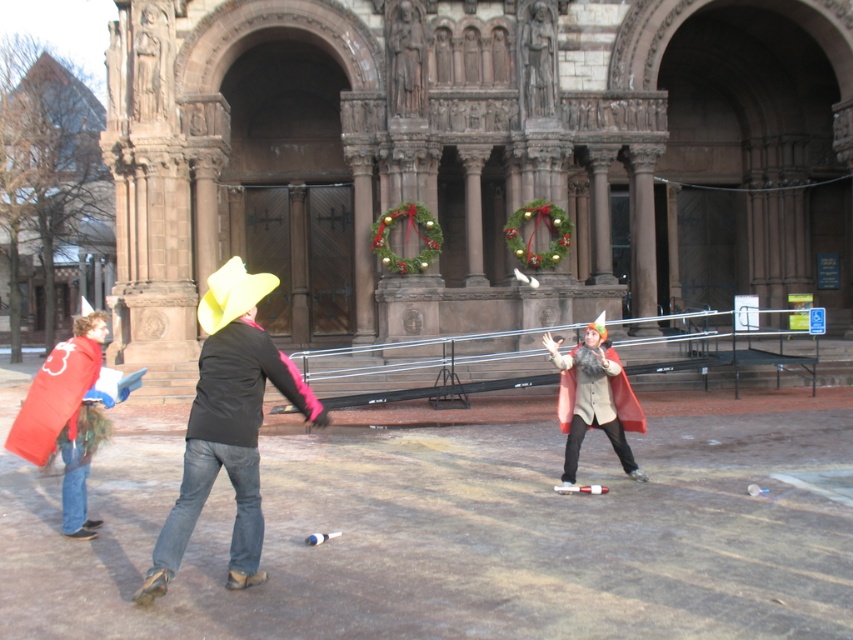
You are a photographer standing in front of the historic building. You want to take a photo of the denim jeans at center and the velvet red cape at center so that both are clearly visible. Which object should you focus on first to ensure proper focus, considering their heights?

The denim jeans at center is much taller than the velvet red cape at center. Therefore, you should focus on the denim jeans at center first since it is taller and might be further away, ensuring the depth of field captures both subjects effectively.

You are standing at the origin point of the image. A friend is wearing denim jeans at center. If you want to walk directly towards their location, which direction should you head? Please provide coordinates based on the image coordinate system where the bottom left corner is the origin point.

The denim jeans at center is located at coordinates point (228, 424). To walk directly towards them, you should head towards the coordinates point (228, 424).

You are a photographer standing in front of the historic building and want to capture a photo of the two people in denim jeans at center and velvet red cape at center. Which one should you focus on first if you want to capture them from left to right in the order they appear?

The denim jeans at center should be focused on first since it is positioned to the left of the velvet red cape at center, aligning with the left to right order.